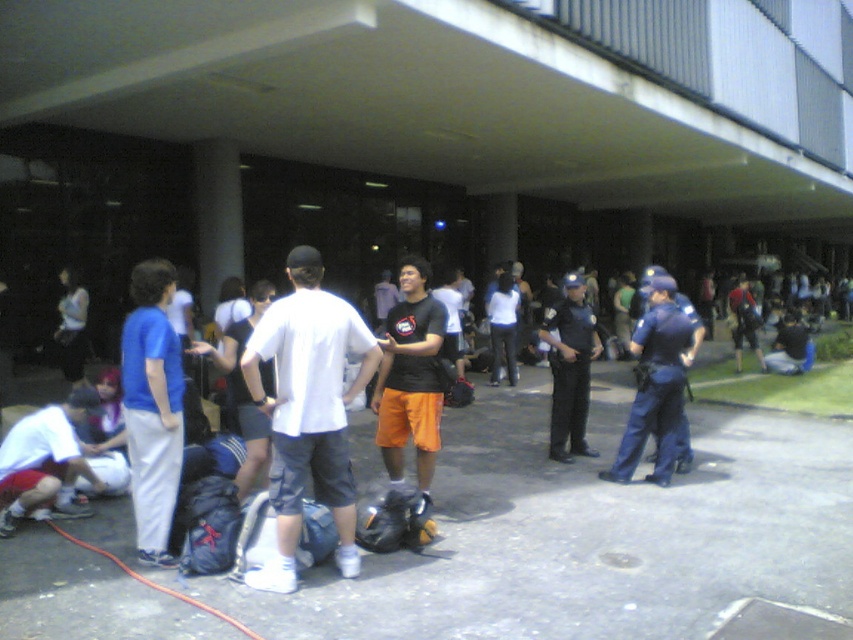
Question: Does dark blue uniform at center lie behind orange shorts at center?

Choices:
 (A) yes
 (B) no

Answer: (B)

Question: Based on their relative distances, which object is farther from the white cotton t-shirt at center?

Choices:
 (A) matte black t-shirt at center
 (B) rubber hose at lower left
 (C) orange shorts at center

Answer: (C)

Question: Is white cotton t-shirt at center thinner than dark blue uniform at center?

Choices:
 (A) no
 (B) yes

Answer: (A)

Question: Does matte black t-shirt at center have a smaller size compared to orange shorts at center?

Choices:
 (A) no
 (B) yes

Answer: (B)

Question: Estimate the real-world distances between objects in this image. Which object is closer to the white matte shirt at lower left?

Choices:
 (A) blue cotton shirt at left
 (B) rubber hose at lower left
 (C) orange shorts at center
 (D) matte black t-shirt at center

Answer: (B)

Question: Among these objects, which one is nearest to the camera?

Choices:
 (A) dark blue uniform at center
 (B) blue uniform pants at center
 (C) rubber hose at lower left

Answer: (C)